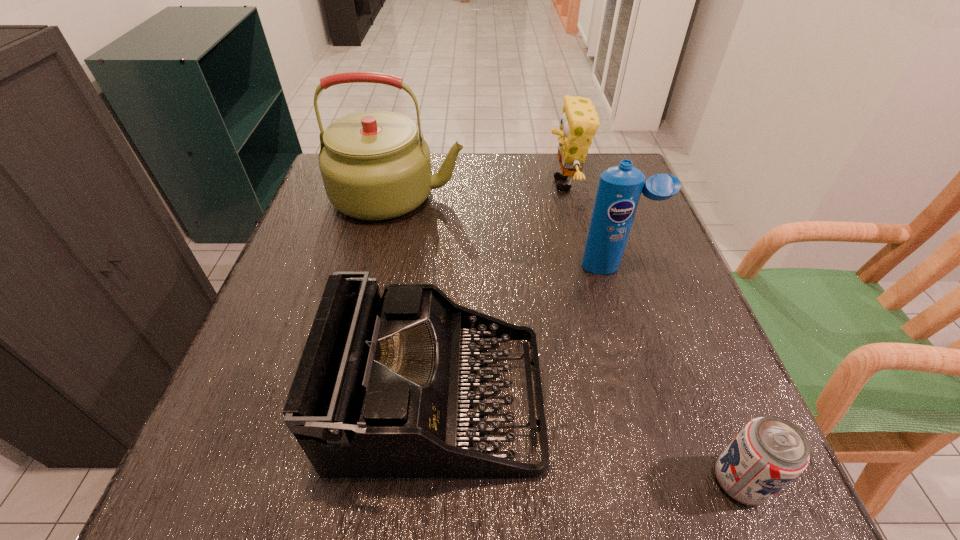
Locate which object ranks second in proximity to the third farthest object. Please provide its 2D coordinates. Your answer should be formatted as a tuple, i.e. [(x, y)], where the tuple contains the x and y coordinates of a point satisfying the conditions above.

[(384, 385)]

This screenshot has height=540, width=960. Find the location of `free space that satisfies the following two spatial constraints: 1. at the spout of the tallest object; 2. on the right side of the third nearest object`. free space that satisfies the following two spatial constraints: 1. at the spout of the tallest object; 2. on the right side of the third nearest object is located at coordinates (381, 267).

Image resolution: width=960 pixels, height=540 pixels. Find the location of `free space that satisfies the following two spatial constraints: 1. on the back side of the shortest object; 2. on the typing side of the typewriter`. free space that satisfies the following two spatial constraints: 1. on the back side of the shortest object; 2. on the typing side of the typewriter is located at coordinates (708, 400).

You are a GUI agent. You are given a task and a screenshot of the screen. Output one action in this format:
    pyautogui.click(x=<x>, y=<y>)
    Task: Click on the vacant space that satisfies the following two spatial constraints: 1. at the spout of the kettle; 2. on the right side of the third nearest object
    The width and height of the screenshot is (960, 540).
    Given the screenshot: What is the action you would take?
    pyautogui.click(x=381, y=267)

At what (x,y) coordinates should I click in order to perform the action: click on free space in the image that satisfies the following two spatial constraints: 1. at the spout of the third farthest object; 2. on the left side of the kettle. Please return your answer as a coordinate pair (x, y). Image resolution: width=960 pixels, height=540 pixels. Looking at the image, I should click on (381, 267).

Find the location of a particular element. This screenshot has width=960, height=540. vacant space that satisfies the following two spatial constraints: 1. on the typing side of the typewriter; 2. on the right side of the beer can is located at coordinates (432, 481).

Locate an element on the screen. vacant region that satisfies the following two spatial constraints: 1. at the spout of the third farthest object; 2. on the left side of the tallest object is located at coordinates (381, 267).

At what (x,y) coordinates should I click in order to perform the action: click on free space that satisfies the following two spatial constraints: 1. on the typing side of the typewriter; 2. on the left side of the shortest object. Please return your answer as a coordinate pair (x, y). The image size is (960, 540). Looking at the image, I should click on (432, 481).